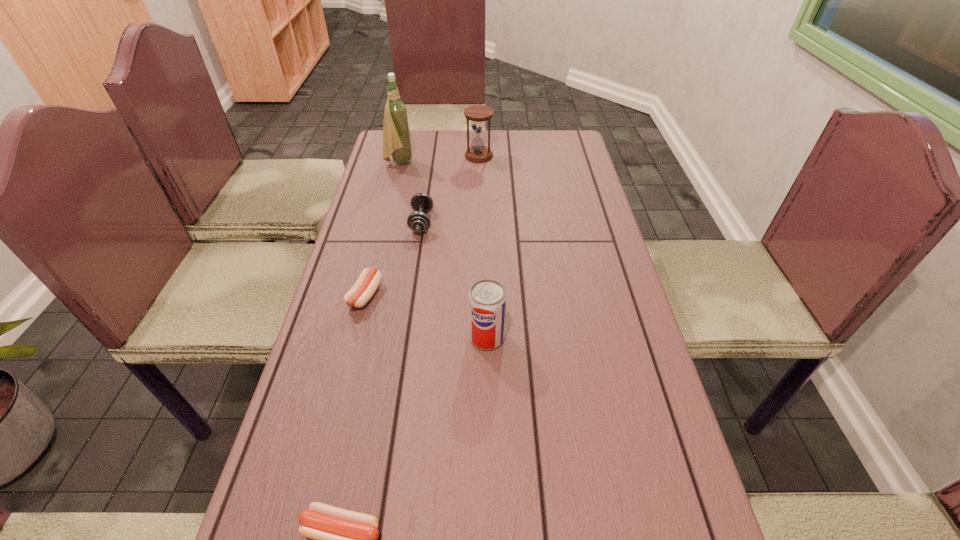
The width and height of the screenshot is (960, 540). I want to click on unoccupied area between the fifth farthest object and the third nearest object, so click(x=426, y=316).

The height and width of the screenshot is (540, 960). Identify the location of free point between the wine bottle and the fourth tallest object. (410, 192).

At what (x,y) coordinates should I click in order to perform the action: click on free space between the fourth nearest object and the wine bottle. Please return your answer as a coordinate pair (x, y). This screenshot has width=960, height=540. Looking at the image, I should click on (410, 192).

Select which object is the closest to the farther sausage. Please provide its 2D coordinates. Your answer should be formatted as a tuple, i.e. [(x, y)], where the tuple contains the x and y coordinates of a point satisfying the conditions above.

[(418, 221)]

Identify which object is the fourth nearest to the fourth nearest object. Please provide its 2D coordinates. Your answer should be formatted as a tuple, i.e. [(x, y)], where the tuple contains the x and y coordinates of a point satisfying the conditions above.

[(487, 300)]

The width and height of the screenshot is (960, 540). I want to click on vacant area in the image that satisfies the following two spatial constraints: 1. on the front-facing side of the wine bottle; 2. on the right side of the fifth farthest object, so click(355, 338).

Locate an element on the screen. This screenshot has height=540, width=960. vacant space that satisfies the following two spatial constraints: 1. on the back side of the third shortest object; 2. on the front-facing side of the tallest object is located at coordinates (430, 162).